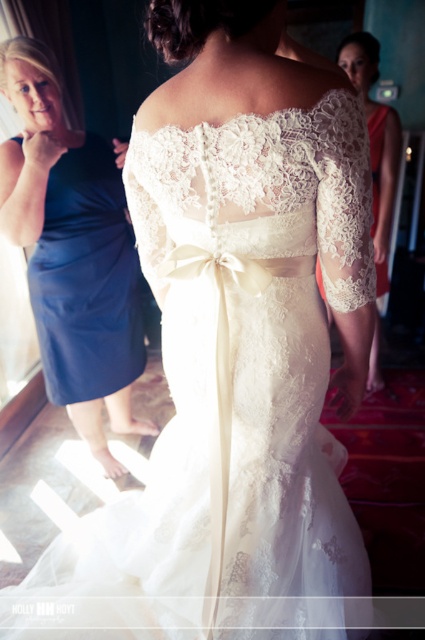
Is blue satin dress at left positioned behind lace fabric dress at upper right?

No.

What do you see at coordinates (71, 252) in the screenshot? I see `blue satin dress at left` at bounding box center [71, 252].

Find the location of a particular element. The image size is (425, 640). blue satin dress at left is located at coordinates (71, 252).